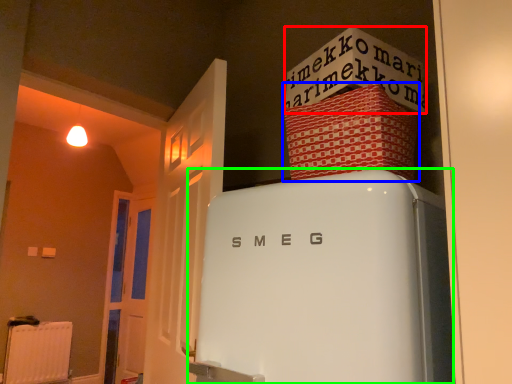
Question: Based on their relative distances, which object is farther from writing (highlighted by a red box)? Choose from cardboard box (highlighted by a blue box) and refrigerator (highlighted by a green box).

Choices:
 (A) cardboard box
 (B) refrigerator

Answer: (B)